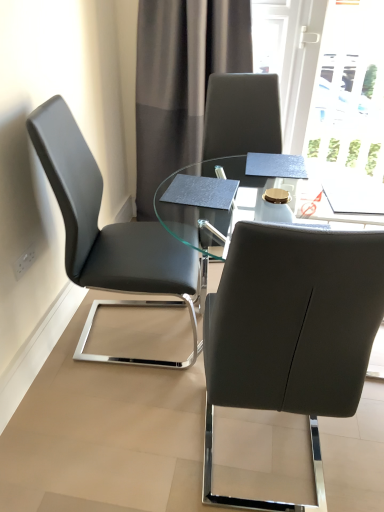
Locate an element on the screen. free space that is in between matte black chair at left, which appears as the 1th chair when viewed from the left, and transparent glass table at center is located at coordinates (129, 369).